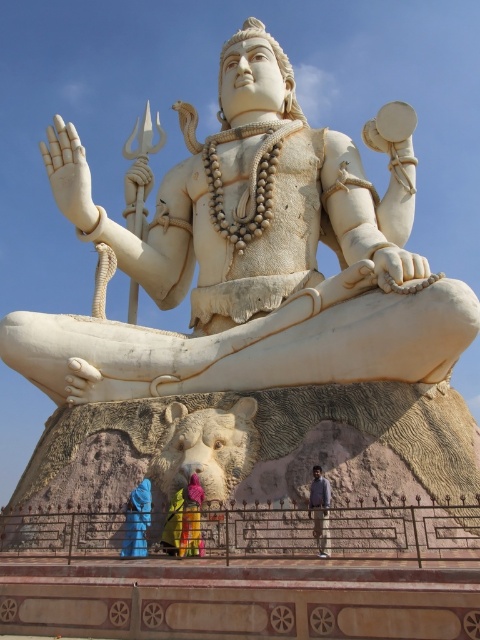
Between blue fabric at lower left and light brown pants at lower center, which one has more height?

blue fabric at lower left is taller.

Between point (145, 540) and point (317, 486), which one is positioned behind?

The point (145, 540) is more distant.

Where is `blue fabric at lower left`? blue fabric at lower left is located at coordinates (136, 520).

Which is below, white marble statue at center or multicolored fabric at lower center?

multicolored fabric at lower center is below.

Between point (290, 348) and point (192, 515), which one is positioned behind?

Positioned behind is point (290, 348).

The image size is (480, 640). Describe the element at coordinates (252, 256) in the screenshot. I see `white marble statue at center` at that location.

Image resolution: width=480 pixels, height=640 pixels. I want to click on white marble statue at center, so click(x=252, y=256).

Can you confirm if multicolored fabric at lower center is positioned below light brown pants at lower center?

Correct, multicolored fabric at lower center is located below light brown pants at lower center.

Which is in front, point (191, 531) or point (324, 504)?

Positioned in front is point (324, 504).

Who is more forward, (197, 486) or (325, 499)?

Point (325, 499) is more forward.

What are the coordinates of `multicolored fabric at lower center` in the screenshot? It's located at (191, 516).